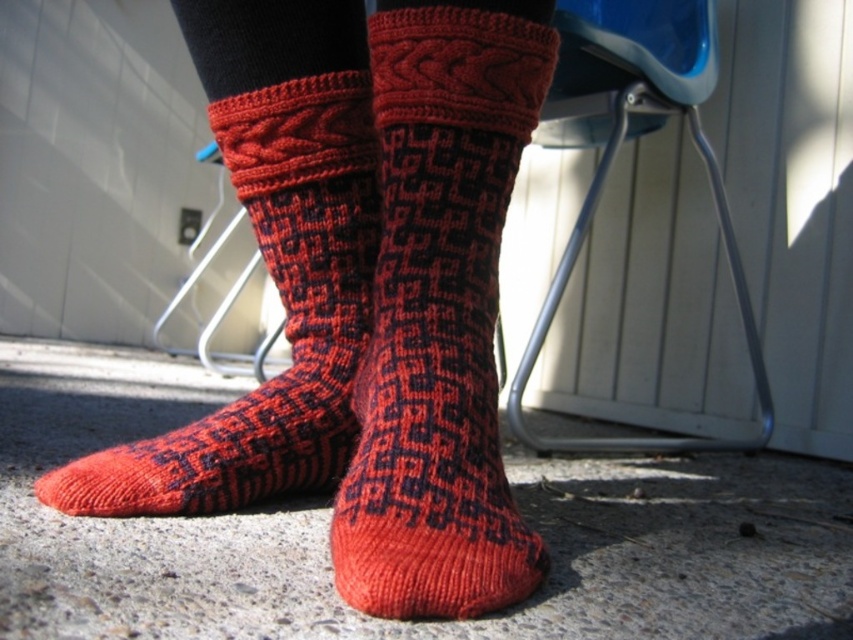
Question: Which of the following is the closest to the observer?

Choices:
 (A) knitted wool socks at center
 (B) knitted woolen sock at center

Answer: (A)

Question: Can you confirm if knitted woolen sock at center is positioned above blue plastic chair at center?

Choices:
 (A) yes
 (B) no

Answer: (B)

Question: From the image, what is the correct spatial relationship of knitted wool socks at center in relation to knitted woolen sock at center?

Choices:
 (A) left
 (B) right

Answer: (B)

Question: Can you confirm if knitted wool socks at center is bigger than knitted woolen sock at center?

Choices:
 (A) no
 (B) yes

Answer: (B)

Question: Which object appears closest to the camera in this image?

Choices:
 (A) knitted wool socks at center
 (B) knitted woolen sock at center

Answer: (A)

Question: Which point is closer to the camera?

Choices:
 (A) knitted wool socks at center
 (B) knitted woolen sock at center

Answer: (A)